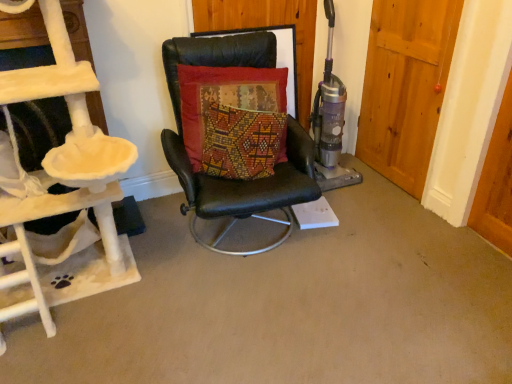
Locate an element on the screen. This screenshot has height=384, width=512. vacant space to the right of beige plush cat tree at left is located at coordinates (207, 310).